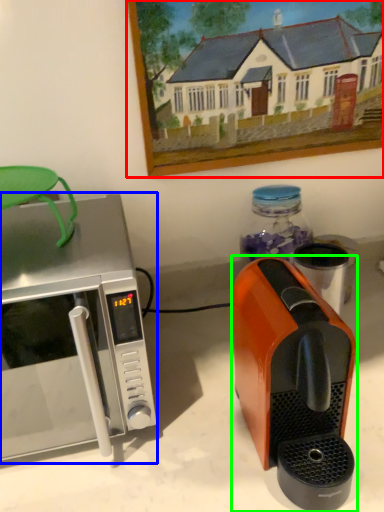
Question: Considering the real-world distances, which object is farthest from picture frame (highlighted by a red box)? microwave oven (highlighted by a blue box) or coffee maker (highlighted by a green box)?

Choices:
 (A) microwave oven
 (B) coffee maker

Answer: (B)